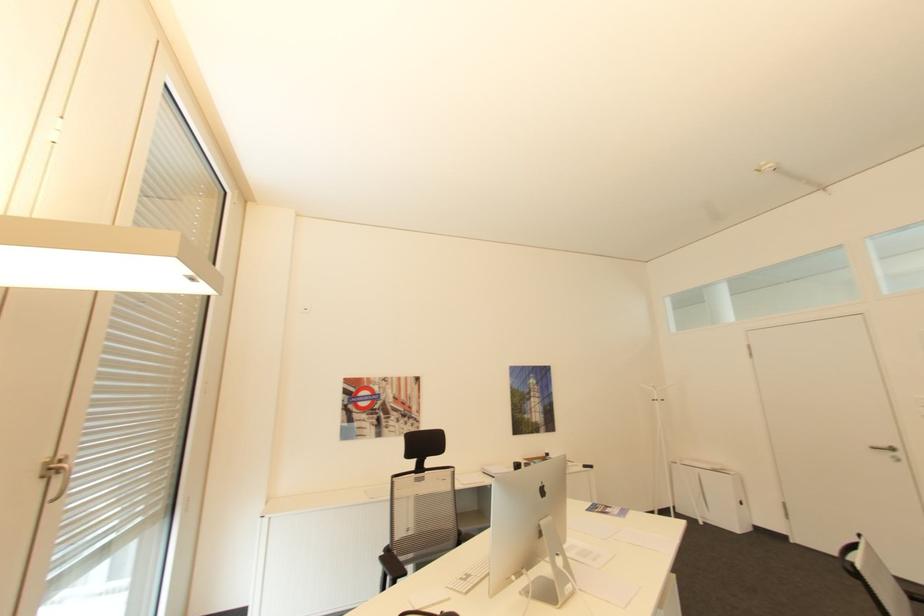
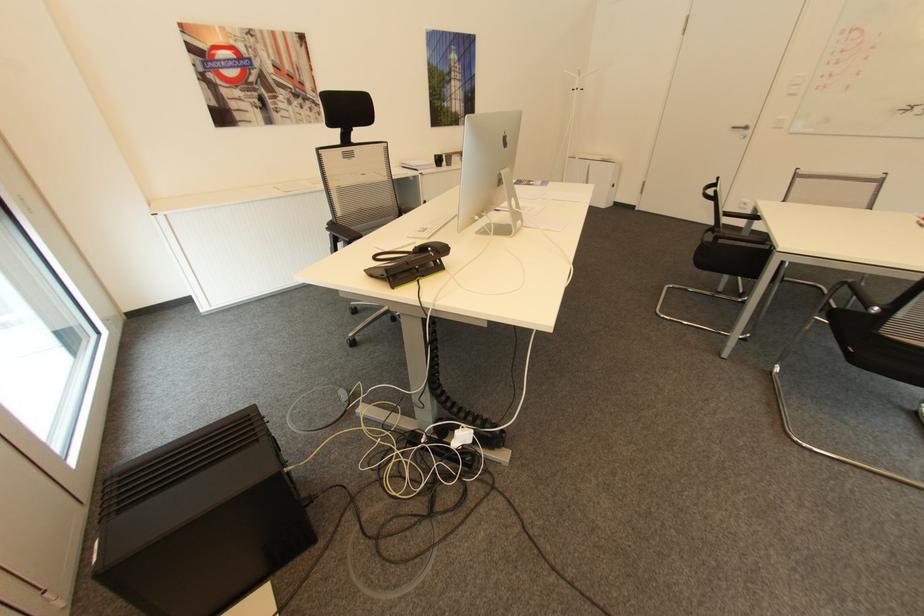
Find the pixel in the second image that matches (x=519, y=463) in the first image.

(441, 155)